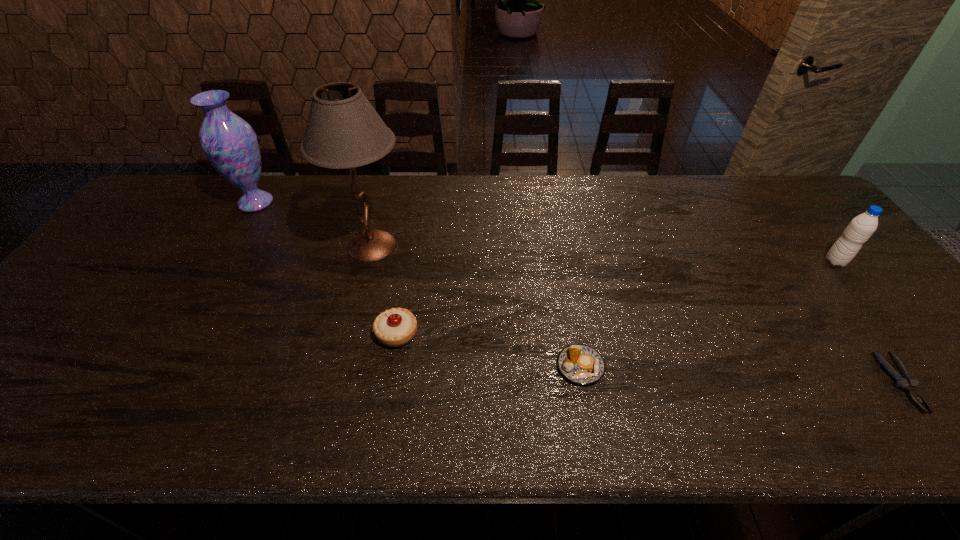
Locate an element on the screen. The height and width of the screenshot is (540, 960). vacant space in between the tallest object and the vase is located at coordinates (314, 224).

Find the location of a particular element. This screenshot has height=540, width=960. empty location between the fifth shortest object and the shortest object is located at coordinates (579, 293).

At what (x,y) coordinates should I click in order to perform the action: click on empty space between the third tallest object and the shortest object. Please return your answer as a coordinate pair (x, y). Looking at the image, I should click on (869, 322).

This screenshot has width=960, height=540. I want to click on free space between the third tallest object and the second object from right to left, so click(869, 322).

The height and width of the screenshot is (540, 960). In order to click on free spot between the fifth shortest object and the table lamp in this screenshot , I will do `click(314, 224)`.

Locate which object is the third closest to the taller pastry. Please provide its 2D coordinates. Your answer should be formatted as a tuple, i.e. [(x, y)], where the tuple contains the x and y coordinates of a point satisfying the conditions above.

[(230, 144)]

Locate an element on the screen. This screenshot has width=960, height=540. object that can be found as the third closest to the fourth tallest object is located at coordinates (230, 144).

This screenshot has width=960, height=540. What are the coordinates of `vacant space that satisfies the following two spatial constraints: 1. on the front-facing side of the left pastry; 2. on the left side of the table lamp` in the screenshot? It's located at (349, 334).

I want to click on vacant point that satisfies the following two spatial constraints: 1. on the front-facing side of the taller pastry; 2. on the left side of the tallest object, so click(349, 334).

Where is `blank space that satisfies the following two spatial constraints: 1. on the front-facing side of the table lamp; 2. on the right side of the right pastry`? This screenshot has height=540, width=960. blank space that satisfies the following two spatial constraints: 1. on the front-facing side of the table lamp; 2. on the right side of the right pastry is located at coordinates (342, 367).